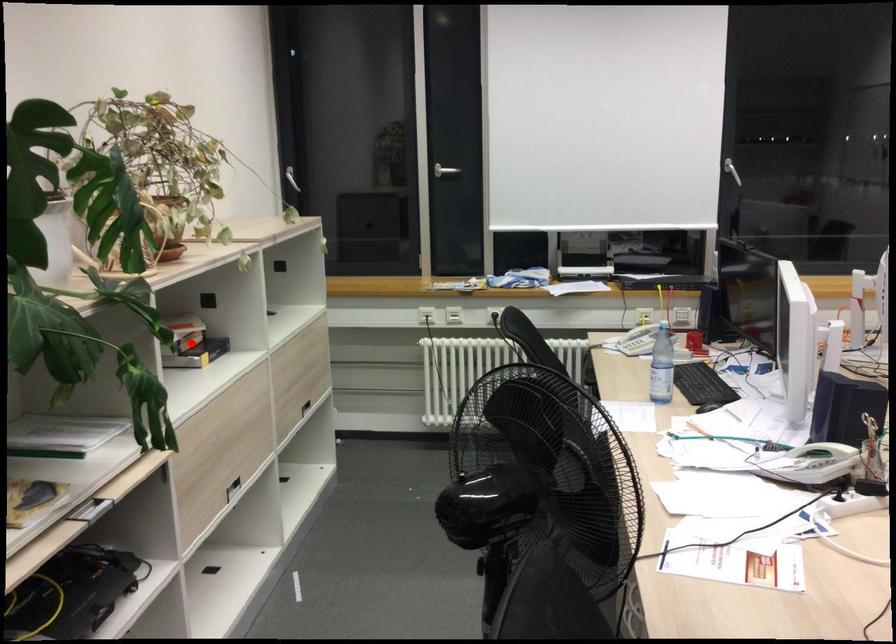
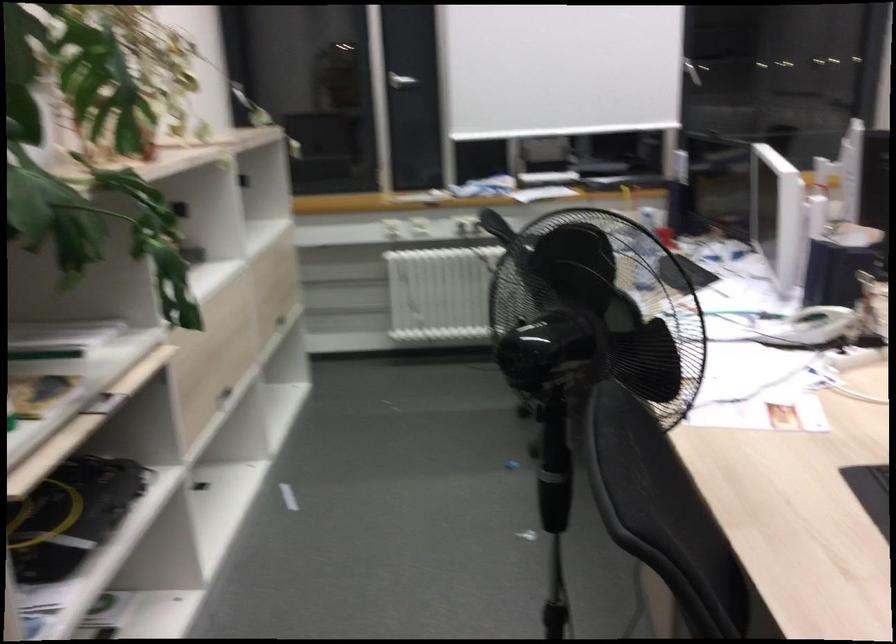
Question: I am providing you with two images of the same scene from different viewpoints. A red point is marked on the first image. At the location where the point appears in image 1, is it still visible in image 2?

Choices:
 (A) Yes
 (B) No

Answer: (B)